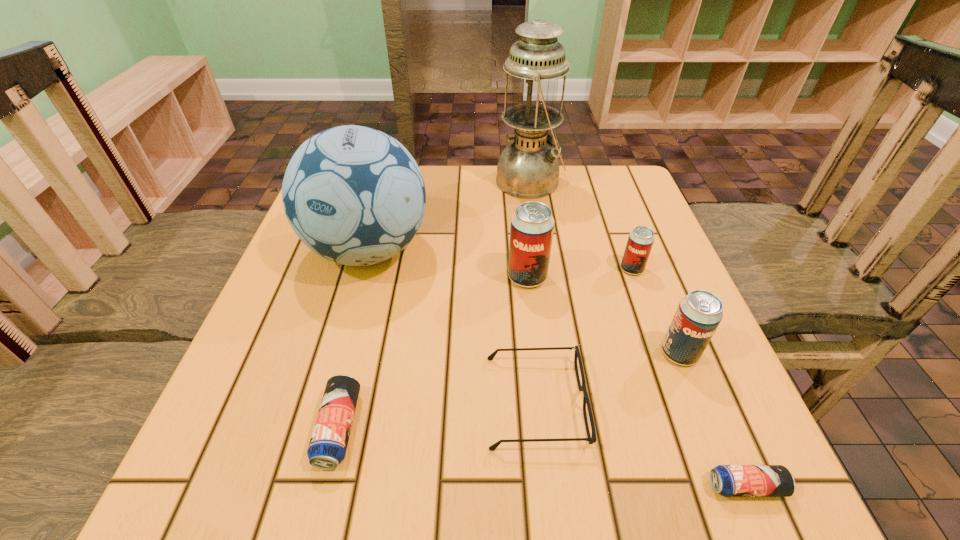
You are a GUI agent. You are given a task and a screenshot of the screen. Output one action in this format:
    pyautogui.click(x=<x>, y=<y>)
    Task: Click on the tallest object
    Image resolution: width=960 pixels, height=540 pixels.
    Given the screenshot: What is the action you would take?
    pyautogui.click(x=528, y=168)

The width and height of the screenshot is (960, 540). Identify the location of oil lamp. (528, 168).

Where is `the second tallest object`? Image resolution: width=960 pixels, height=540 pixels. the second tallest object is located at coordinates (354, 195).

This screenshot has width=960, height=540. I want to click on soccer ball, so click(354, 195).

The width and height of the screenshot is (960, 540). I want to click on the third tallest object, so click(532, 225).

Where is `the leftmost red beer can`? the leftmost red beer can is located at coordinates (532, 225).

You are a GUI agent. You are given a task and a screenshot of the screen. Output one action in this format:
    pyautogui.click(x=<x>, y=<y>)
    Task: Click on the nearest red beer can
    
    Given the screenshot: What is the action you would take?
    pyautogui.click(x=699, y=313)

Find the location of `the second tallest beer can`. the second tallest beer can is located at coordinates (699, 313).

Locate an element on the screen. the fifth tallest object is located at coordinates (640, 241).

At what (x,y) coordinates should I click in order to perform the action: click on the third shortest beer can. Please return your answer as a coordinate pair (x, y). Image resolution: width=960 pixels, height=540 pixels. Looking at the image, I should click on (640, 241).